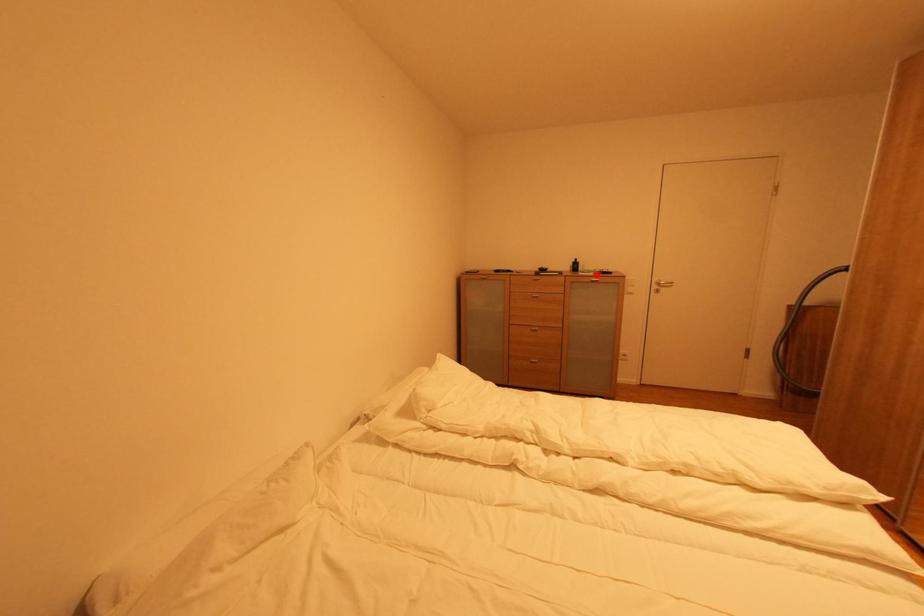
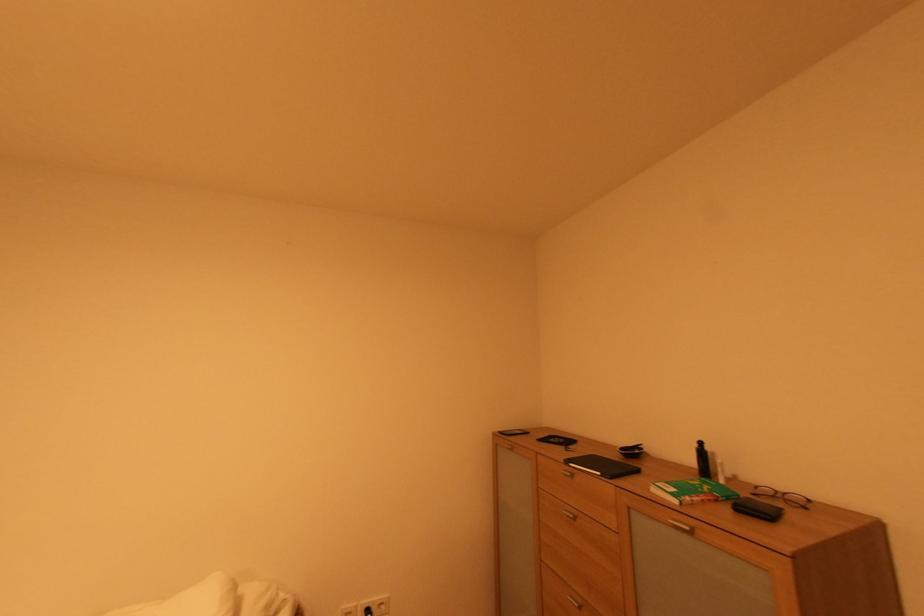
In the second image, find the point that corresponds to the highlighted location in the first image.

(682, 503)